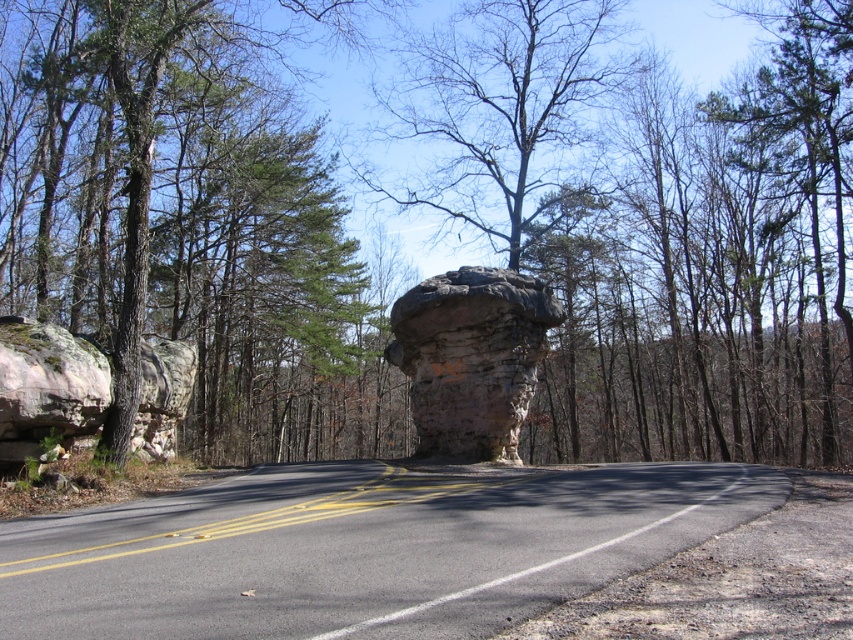
Question: Estimate the real-world distances between objects in this image. Which object is closer to the rustic stone boulder at left?

Choices:
 (A) rusty stone formation at center
 (B) green mossy rock at center

Answer: (A)

Question: Estimate the real-world distances between objects in this image. Which object is farther from the rustic stone boulder at left?

Choices:
 (A) rusty stone formation at center
 (B) green textured tree at center
 (C) green mossy rock at center

Answer: (B)

Question: Can you confirm if green textured tree at center is positioned below rusty stone formation at center?

Choices:
 (A) yes
 (B) no

Answer: (B)

Question: Estimate the real-world distances between objects in this image. Which object is closer to the green mossy rock at center?

Choices:
 (A) green textured tree at center
 (B) rusty stone formation at center

Answer: (A)

Question: Observing the image, what is the correct spatial positioning of green textured tree at center in reference to green mossy rock at center?

Choices:
 (A) left
 (B) right

Answer: (B)

Question: Can you confirm if green mossy rock at center is positioned to the left of rustic stone boulder at left?

Choices:
 (A) no
 (B) yes

Answer: (B)